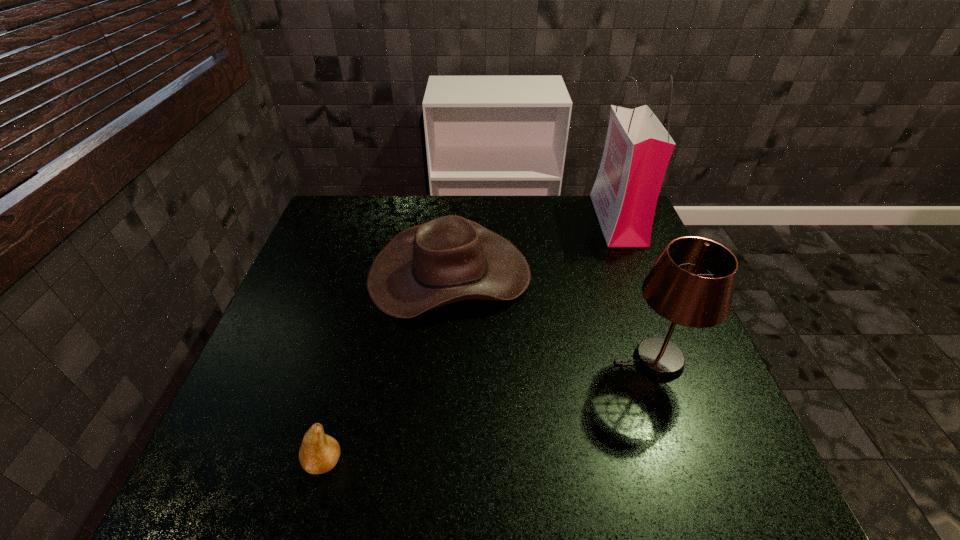
Where is `empty space between the shortest object and the shopping bag`? This screenshot has width=960, height=540. empty space between the shortest object and the shopping bag is located at coordinates (470, 341).

This screenshot has height=540, width=960. Identify the location of unoccupied area between the cowboy hat and the second tallest object. (552, 318).

Image resolution: width=960 pixels, height=540 pixels. What are the coordinates of `vacant point located between the nearest object and the shopping bag` in the screenshot? It's located at (470, 341).

The image size is (960, 540). What are the coordinates of `vacant space that's between the third tallest object and the third shortest object` in the screenshot? It's located at (552, 318).

You are a GUI agent. You are given a task and a screenshot of the screen. Output one action in this format:
    pyautogui.click(x=<x>, y=<y>)
    Task: Click on the unoccupied position between the second shortest object and the third shortest object
    Image resolution: width=960 pixels, height=540 pixels.
    Given the screenshot: What is the action you would take?
    pyautogui.click(x=552, y=318)

Identify which object is the third closest to the tallest object. Please provide its 2D coordinates. Your answer should be formatted as a tuple, i.e. [(x, y)], where the tuple contains the x and y coordinates of a point satisfying the conditions above.

[(319, 453)]

In order to click on the closest object relative to the lampshade in this screenshot , I will do `click(449, 259)`.

You are a GUI agent. You are given a task and a screenshot of the screen. Output one action in this format:
    pyautogui.click(x=<x>, y=<y>)
    Task: Click on the vacant space that satisfies the following two spatial constraints: 1. on the front-facing side of the shopping bag; 2. on the front side of the second shortest object
    Image resolution: width=960 pixels, height=540 pixels.
    Given the screenshot: What is the action you would take?
    pyautogui.click(x=639, y=274)